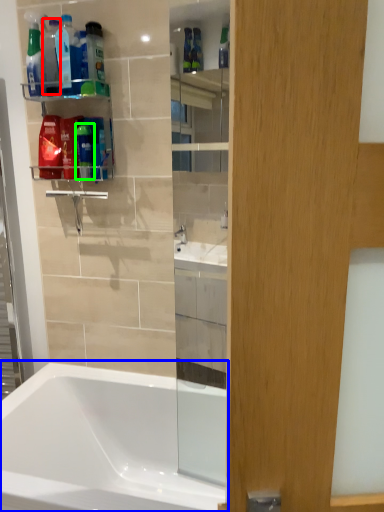
Question: Considering the real-world distances, which object is closest to bottle (highlighted by a red box)? bathtub (highlighted by a blue box) or toiletry (highlighted by a green box).

Choices:
 (A) bathtub
 (B) toiletry

Answer: (B)